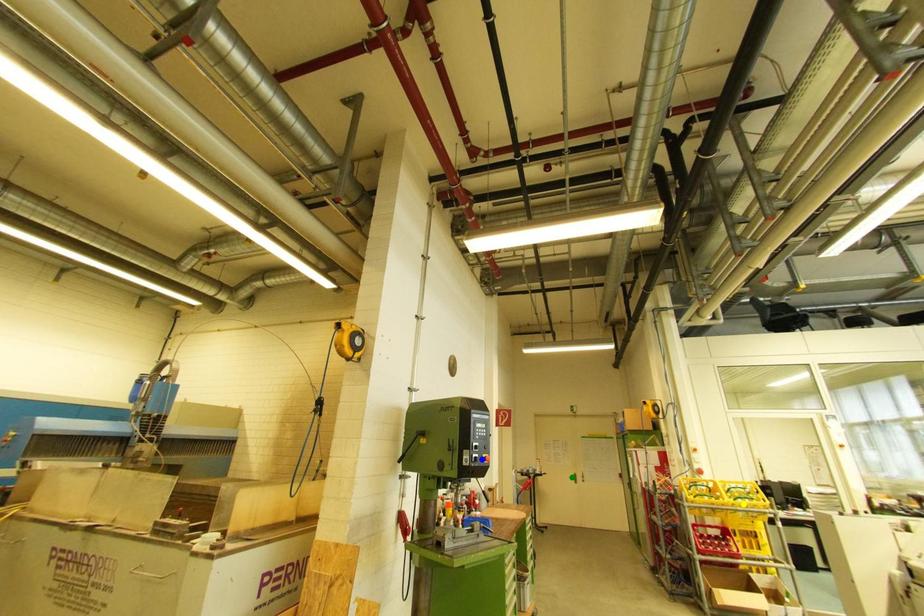
Order these from farthest to nearest:
blue point, green point, yellow point

green point → yellow point → blue point